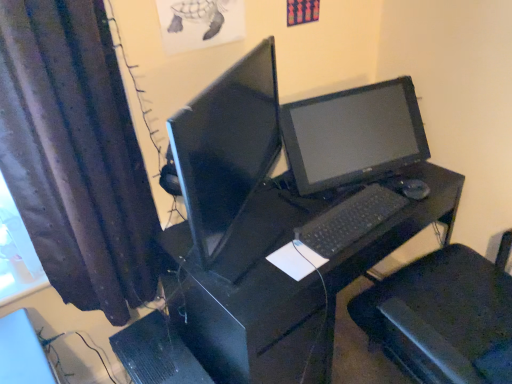
This screenshot has width=512, height=384. What do you see at coordinates (413, 189) in the screenshot?
I see `black plastic mouse at right` at bounding box center [413, 189].

In order to click on white paper at center in this screenshot , I will do `click(296, 260)`.

In order to face matte black monitor at center, should I rotate leftwards or rightwards?

Rotate left and turn 2.652 degrees.

In order to click on dark fabric curtain at left in this screenshot , I will do `click(76, 155)`.

Would you say black matte keyboard at center is a long distance from black plastic desk at center?

black matte keyboard at center is near black plastic desk at center, not far away.

Is black matte keyboard at center bigger or smaller than black plastic desk at center?

Considering their sizes, black matte keyboard at center takes up less space than black plastic desk at center.

Is black matte keyboard at center facing towards black plastic desk at center?

No, black matte keyboard at center is not aimed at black plastic desk at center.

From a real-world perspective, who is located lower, black plastic mouse at right or matte black monitor at center?

black plastic mouse at right.

Looking at their sizes, would you say black plastic mouse at right is wider or thinner than matte black monitor at center?

Considering their sizes, black plastic mouse at right looks slimmer than matte black monitor at center.

Is black plastic mouse at right in front of or behind matte black monitor at center in the image?

Visually, black plastic mouse at right is located behind matte black monitor at center.

Based on the photo, in the image, is black plastic mouse at right on the left side or the right side of matte black monitor at center?

Clearly, black plastic mouse at right is on the right of matte black monitor at center in the image.

You are a GUI agent. You are given a task and a screenshot of the screen. Output one action in this format:
    pyautogui.click(x=<x>, y=<y>)
    Task: Click on the curtain on the left side of black matte keyboard at center
    The height and width of the screenshot is (384, 512).
    Given the screenshot: What is the action you would take?
    pyautogui.click(x=76, y=155)

Considering the sizes of objects black matte keyboard at center and dark fabric curtain at left in the image provided, who is bigger, black matte keyboard at center or dark fabric curtain at left?

dark fabric curtain at left is bigger.

Is black matte keyboard at center behind dark fabric curtain at left?

Yes.

Does black matte keyboard at center turn towards dark fabric curtain at left?

No, black matte keyboard at center does not turn towards dark fabric curtain at left.

Which of these two, black plastic desk at center or matte black monitor at center, stands shorter?

Standing shorter between the two is matte black monitor at center.

Identify the location of computer monitor that appears in front of the black plastic desk at center. This screenshot has height=384, width=512. (229, 161).

Which is behind, black plastic desk at center or matte black monitor at center?

black plastic desk at center.

From a real-world perspective, between black plastic desk at center and matte black monitor at center, who is vertically lower?

black plastic desk at center.

Considering the positions of objects dark fabric curtain at left and black plastic desk at center in the image provided, who is more to the left, dark fabric curtain at left or black plastic desk at center?

From the viewer's perspective, dark fabric curtain at left appears more on the left side.

Is dark fabric curtain at left behind black plastic desk at center?

No, it is in front of black plastic desk at center.

Is dark fabric curtain at left facing away from black plastic desk at center?

dark fabric curtain at left does not have its back to black plastic desk at center.

Which is farther, (314, 263) or (197, 372)?

Positioned behind is point (197, 372).

Looking at this image, can you confirm if white paper at center is positioned to the left of black plastic computer tower at lower center?

In fact, white paper at center is to the right of black plastic computer tower at lower center.

From a real-world perspective, is white paper at center physically above black plastic computer tower at lower center?

Yes, from a real-world perspective, white paper at center is over black plastic computer tower at lower center

Who is bigger, white paper at center or black plastic computer tower at lower center?

black plastic computer tower at lower center is bigger.

Does black plastic computer tower at lower center have a larger size compared to dark fabric curtain at left?

Result: No, black plastic computer tower at lower center is not bigger than dark fabric curtain at left.

From the image's perspective, which is below, black plastic computer tower at lower center or dark fabric curtain at left?

From the image's view, black plastic computer tower at lower center is below.

Is the surface of black plastic computer tower at lower center in direct contact with dark fabric curtain at left?

There is a gap between black plastic computer tower at lower center and dark fabric curtain at left.

Between black plastic computer tower at lower center and dark fabric curtain at left, which one appears on the left side from the viewer's perspective?

dark fabric curtain at left is more to the left.

The height and width of the screenshot is (384, 512). What are the coordinates of `computer keyboard lying on the right of black plastic desk at center` in the screenshot? It's located at (349, 220).

I want to click on computer monitor that appears above the black plastic mouse at right (from a real-world perspective), so click(x=229, y=161).

Estimate the real-world distances between objects in this image. Which object is further from matte black monitor at center, black matte keyboard at center or black plastic computer tower at lower center?

The object further to matte black monitor at center is black plastic computer tower at lower center.

Estimate the real-world distances between objects in this image. Which object is closer to white paper at center, black matte keyboard at center or black plastic mouse at right?

black matte keyboard at center lies closer to white paper at center than the other object.

From the picture: Based on their spatial positions, is black plastic mouse at right or black plastic computer tower at lower center further from dark fabric curtain at left?

Among the two, black plastic mouse at right is located further to dark fabric curtain at left.

From the image, which object appears to be farther from dark fabric curtain at left, black matte keyboard at center or white paper at center?

black matte keyboard at center is positioned further to the anchor dark fabric curtain at left.

When comparing their distances from white paper at center, does black plastic desk at center or black plastic computer tower at lower center seem closer?

Among the two, black plastic desk at center is located nearer to white paper at center.

Considering their positions, is white paper at center positioned further to dark fabric curtain at left than matte black monitor at center?

The object further to dark fabric curtain at left is white paper at center.

Which object lies further to the anchor point black plastic computer tower at lower center, matte black monitor at center or white paper at center?

matte black monitor at center is further to black plastic computer tower at lower center.

Based on their spatial positions, is black plastic computer tower at lower center or black matte keyboard at center closer to black plastic mouse at right?

black matte keyboard at center lies closer to black plastic mouse at right than the other object.

Image resolution: width=512 pixels, height=384 pixels. I want to click on curtain that lies between matte black monitor at center and black plastic computer tower at lower center from top to bottom, so click(x=76, y=155).

I want to click on desk situated between black plastic computer tower at lower center and black plastic mouse at right from left to right, so click(290, 277).

I want to click on notepad between black matte keyboard at center and black plastic computer tower at lower center in the vertical direction, so click(x=296, y=260).

I want to click on computer tower located between dark fabric curtain at left and black plastic desk at center in the left-right direction, so (x=157, y=353).